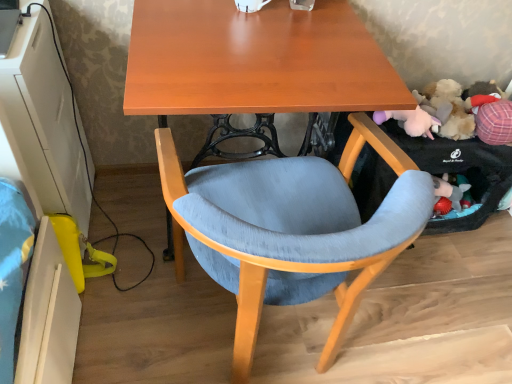
Identify the location of spots to the right of textured fabric chair at center. (425, 315).